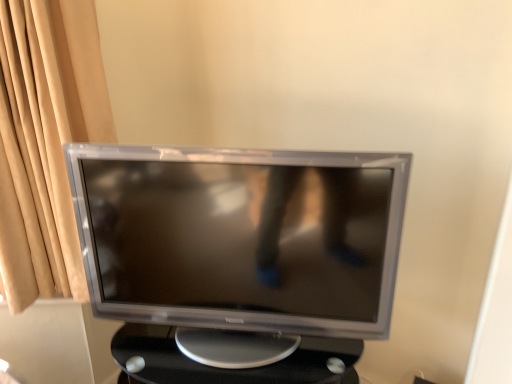
Question: Is satin silver monitor at center a part of black plastic table at center?

Choices:
 (A) yes
 (B) no

Answer: (B)

Question: Does black plastic table at center have a smaller size compared to satin silver monitor at center?

Choices:
 (A) yes
 (B) no

Answer: (B)

Question: Is black plastic table at center outside satin silver monitor at center?

Choices:
 (A) yes
 (B) no

Answer: (A)

Question: Does black plastic table at center have a larger size compared to satin silver monitor at center?

Choices:
 (A) yes
 (B) no

Answer: (A)

Question: Does black plastic table at center have a lesser height compared to satin silver monitor at center?

Choices:
 (A) no
 (B) yes

Answer: (B)

Question: Is black plastic table at center positioned far away from satin silver monitor at center?

Choices:
 (A) yes
 (B) no

Answer: (B)

Question: Does satin silver monitor at center have a greater height compared to black plastic table at center?

Choices:
 (A) yes
 (B) no

Answer: (A)

Question: Is satin silver monitor at center further to the viewer compared to black plastic table at center?

Choices:
 (A) no
 (B) yes

Answer: (A)

Question: From the image's perspective, is satin silver monitor at center beneath black plastic table at center?

Choices:
 (A) no
 (B) yes

Answer: (A)

Question: Is satin silver monitor at center positioned with its back to black plastic table at center?

Choices:
 (A) no
 (B) yes

Answer: (A)

Question: Does satin silver monitor at center have a lesser height compared to black plastic table at center?

Choices:
 (A) yes
 (B) no

Answer: (B)

Question: Is black plastic table at center completely or partially inside satin silver monitor at center?

Choices:
 (A) no
 (B) yes

Answer: (A)

Question: From a real-world perspective, relative to satin silver monitor at center, is black plastic table at center vertically above or below?

Choices:
 (A) below
 (B) above

Answer: (A)